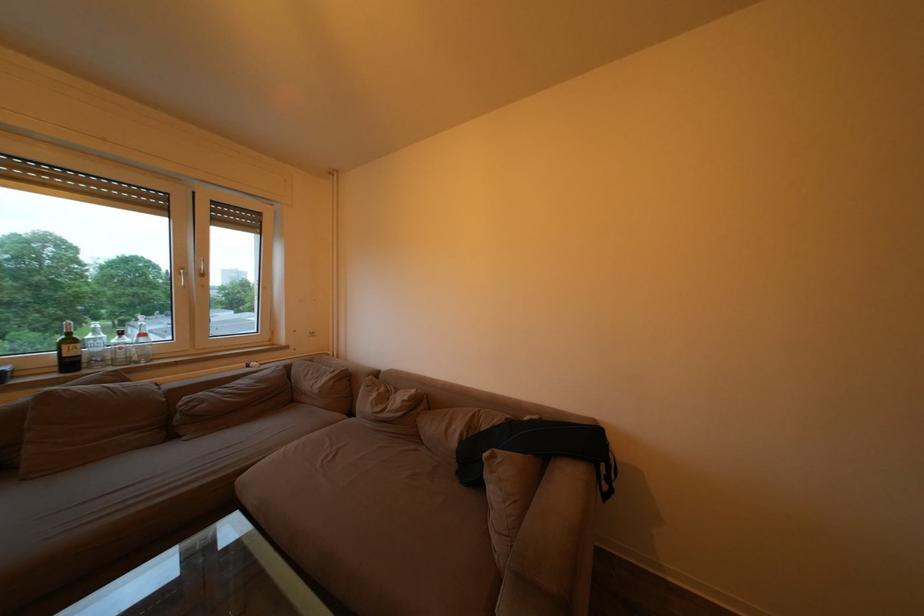
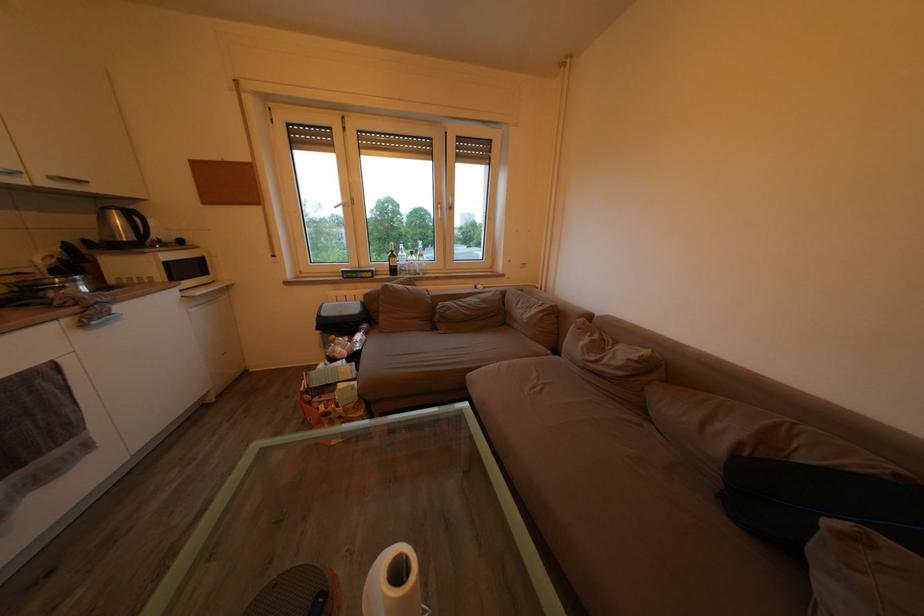
Question: How did the camera likely rotate?

Choices:
 (A) Left
 (B) Right
 (C) Up
 (D) Down

Answer: (A)